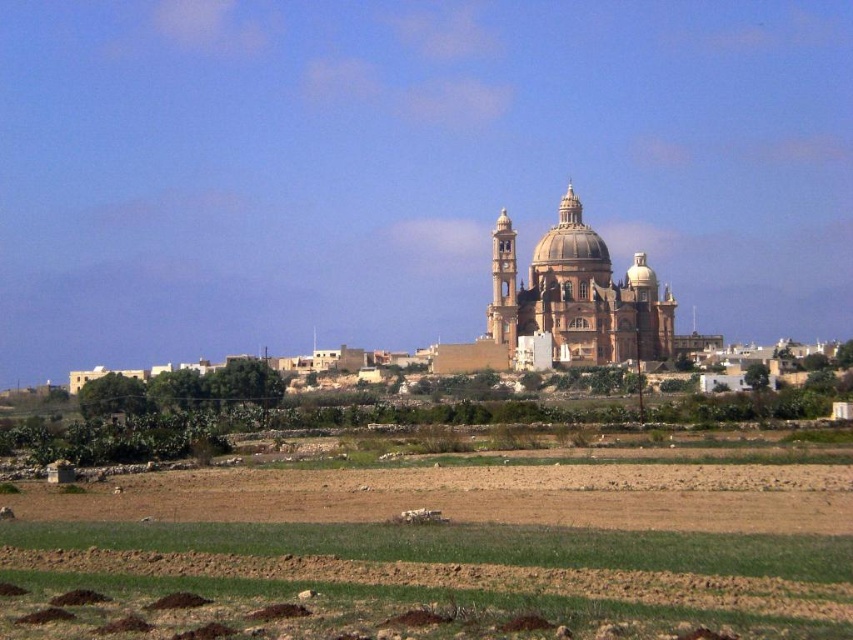
Looking at this image, you are a photographer planning to capture the brown stone church at center from the brown soil field at lower center. Considering their relative heights, will the church be fully visible in your photo without any obstructions?

The brown soil field at lower center is shorter than the brown stone church at center, so the church will be fully visible in the photo without obstructions.

You are standing at the point marked as point [442,552] in the image. What is the color of the ground beneath your feet?

The ground beneath your feet at point [442,552] is brown soil field at lower center.